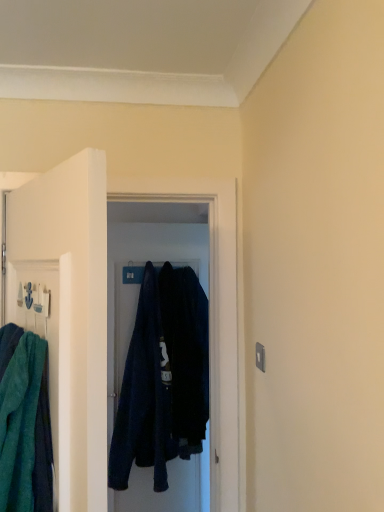
Question: Does dark blue fabric at center turn towards dark blue fabric robe at center?

Choices:
 (A) yes
 (B) no

Answer: (A)

Question: Does dark blue fabric at center have a larger size compared to dark blue fabric robe at center?

Choices:
 (A) yes
 (B) no

Answer: (A)

Question: From a real-world perspective, is dark blue fabric at center located higher than dark blue fabric robe at center?

Choices:
 (A) no
 (B) yes

Answer: (A)

Question: From the image's perspective, is dark blue fabric at center above dark blue fabric robe at center?

Choices:
 (A) yes
 (B) no

Answer: (B)

Question: Is the depth of dark blue fabric at center greater than that of dark blue fabric robe at center?

Choices:
 (A) no
 (B) yes

Answer: (B)

Question: From the image's perspective, would you say dark blue fabric at center is shown under dark blue fabric robe at center?

Choices:
 (A) no
 (B) yes

Answer: (B)

Question: Does dark blue fabric robe at center have a larger size compared to dark blue fabric at center?

Choices:
 (A) yes
 (B) no

Answer: (B)

Question: Does dark blue fabric robe at center appear on the left side of dark blue fabric at center?

Choices:
 (A) yes
 (B) no

Answer: (A)

Question: Does dark blue fabric robe at center have a smaller size compared to dark blue fabric at center?

Choices:
 (A) no
 (B) yes

Answer: (B)

Question: Is dark blue fabric robe at center shorter than dark blue fabric at center?

Choices:
 (A) no
 (B) yes

Answer: (B)

Question: Does dark blue fabric robe at center turn towards dark blue fabric at center?

Choices:
 (A) no
 (B) yes

Answer: (A)

Question: Is the depth of dark blue fabric robe at center less than that of dark blue fabric at center?

Choices:
 (A) no
 (B) yes

Answer: (B)

Question: Is teal towel at left positioned with its back to dark blue fabric robe at center?

Choices:
 (A) no
 (B) yes

Answer: (A)